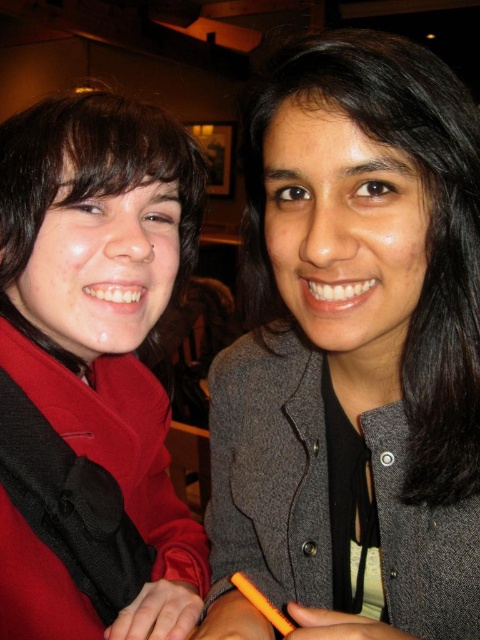
You are a photographer trying to adjust the lighting in the scene. You have two light sources positioned at point [435,212] and point [153,465]. Which light source is closer to the camera?

Point [435,212] is in front of point [153,465], so the light source at point [435,212] is closer to the camera.

You are a photographer setting up for a group photo. You need to ensure that the gray woolen jacket at center and the matte red coat at left are both visible in the frame. Based on their positions, which one should you focus on first to ensure the entire jacket and coat are in focus?

The gray woolen jacket at center is above the matte red coat at left, so you should focus on the matte red coat at left first to ensure both are in focus.